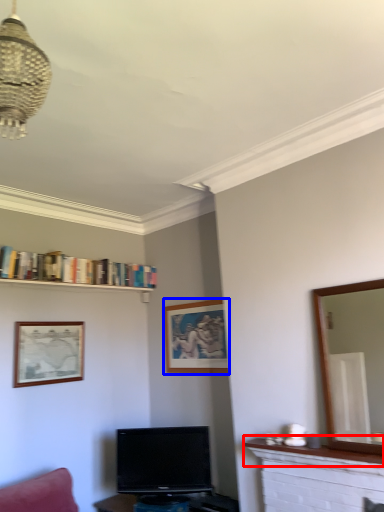
Question: Among these objects, which one is farthest to the camera, mantle (highlighted by a red box) or picture frame (highlighted by a blue box)?

Choices:
 (A) mantle
 (B) picture frame

Answer: (B)